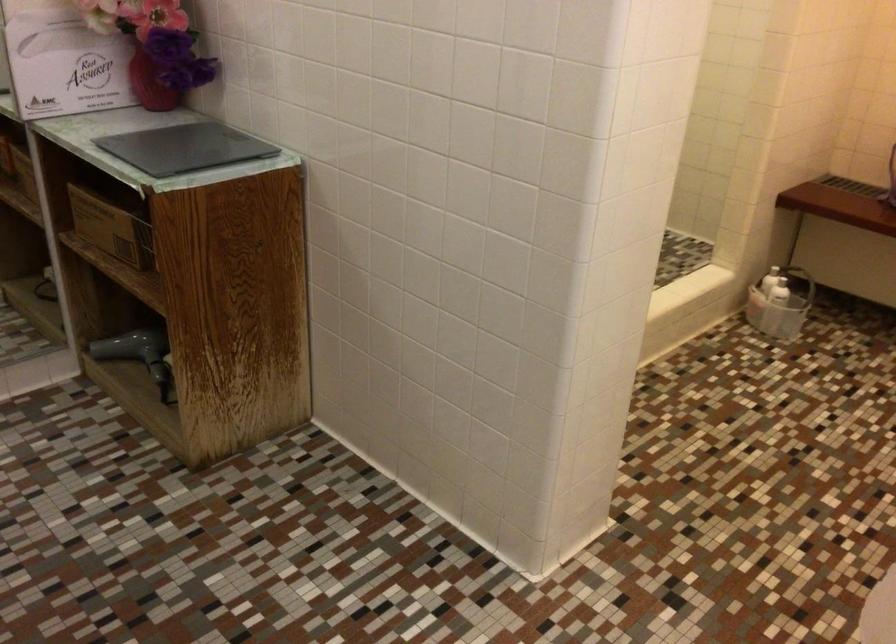
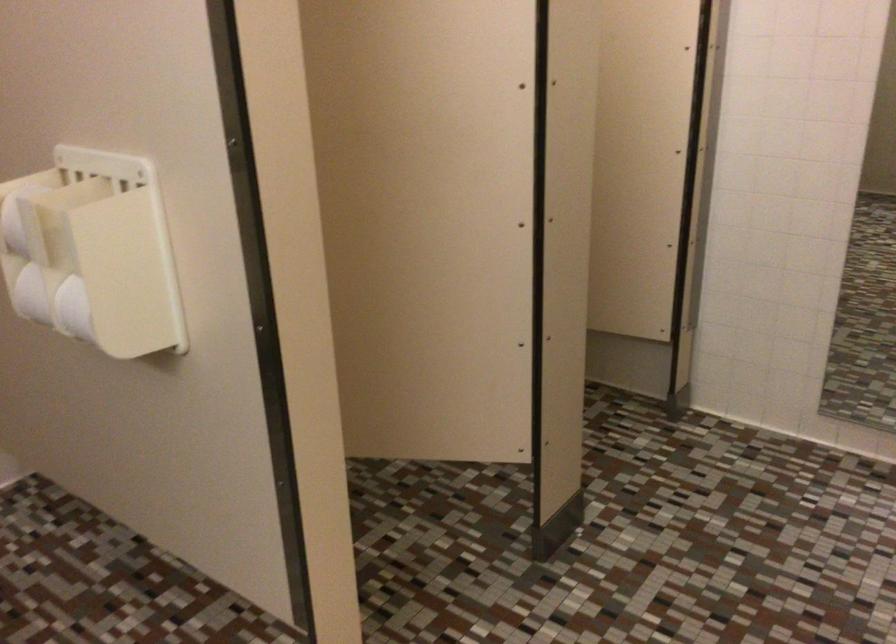
Question: The first image is from the beginning of the video and the second image is from the end. How did the camera likely rotate when shooting the video?

Choices:
 (A) Left
 (B) Right
 (C) Up
 (D) Down

Answer: (A)